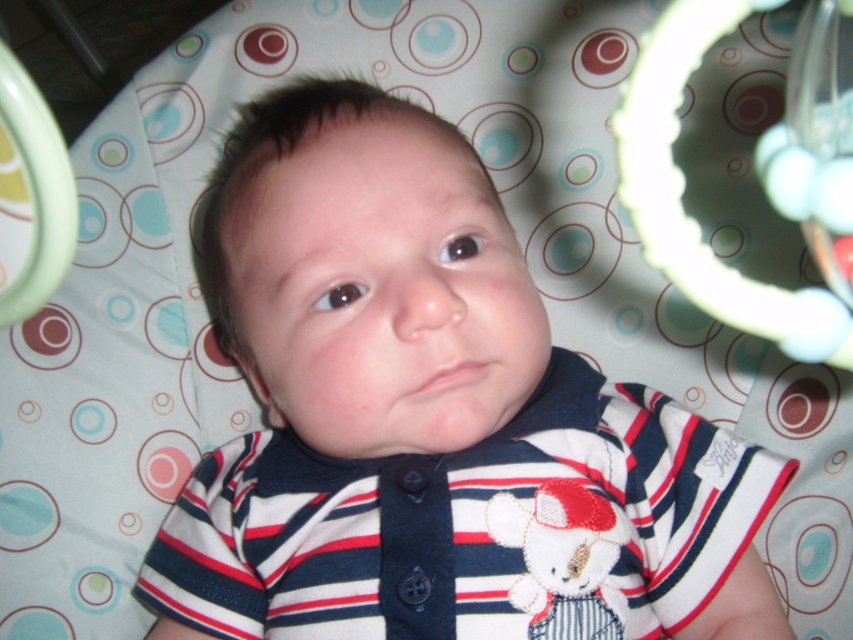
You are holding a small toy that is 3 inches long and want to place it in the playpen so that it is exactly at the point labeled as point (708, 273). Considering the playpen is 24 inches wide, can you fit the toy at that exact point without it going over the edges?

The point (708, 273) is 13.14 inches away from the viewer. Since the toy is only 3 inches long, placing it at that point would require ensuring it stays within the playpen boundaries. However, the playpen is 24 inches wide, so as long as the placement is accurate, the toy can fit without going over the edges.